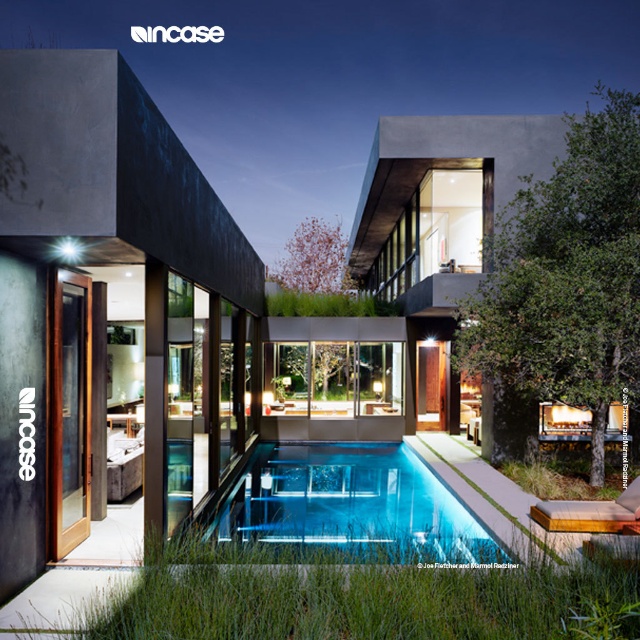
Based on the photo, you are standing in front of the house and want to enter through the transparent wood glass door at left. As you face the door, where would the blue glass pool at center be located relative to your position?

The blue glass pool at center is to the right of the transparent wood glass door at left, so when facing the door, the pool would be on your right side.

You are a delivery person trying to navigate through the property to reach the front door. You see the blue glass pool at center and the transparent wood glass door at left. Which object is wider from your perspective?

The blue glass pool at center might be wider than transparent wood glass door at left according to the description.